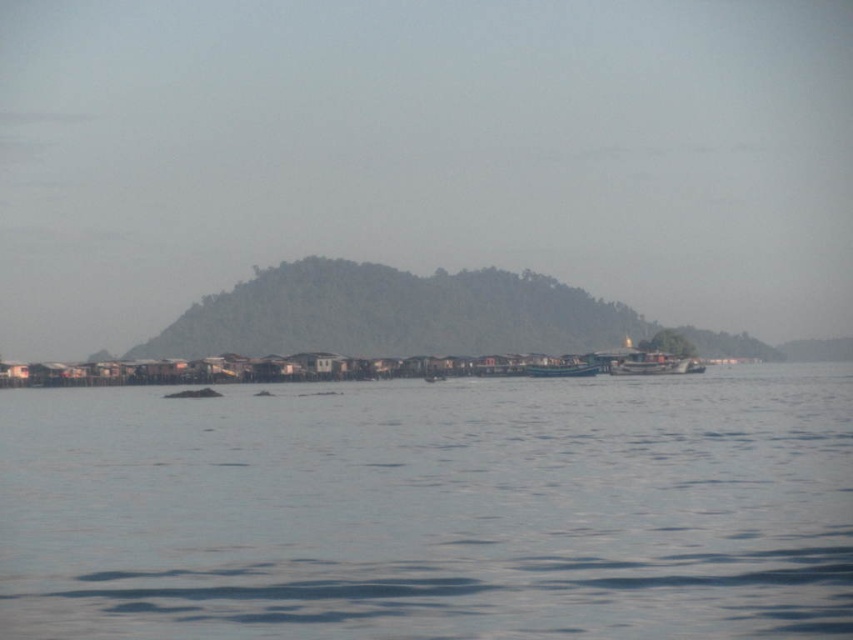
Question: From the image, what is the correct spatial relationship of clear blue water at center in relation to metallic silver boat at center?

Choices:
 (A) above
 (B) below

Answer: (B)

Question: Which object appears farthest from the camera in this image?

Choices:
 (A) metallic silver boat at center
 (B) clear blue water at center

Answer: (A)

Question: Which of the following is the closest to the observer?

Choices:
 (A) (701, 368)
 (B) (671, 412)

Answer: (B)

Question: Does clear blue water at center appear under metallic silver boat at center?

Choices:
 (A) yes
 (B) no

Answer: (A)

Question: Can you confirm if clear blue water at center is bigger than wooden boat at center?

Choices:
 (A) no
 (B) yes

Answer: (B)

Question: Which object appears farthest from the camera in this image?

Choices:
 (A) clear blue water at center
 (B) wooden boat at center

Answer: (B)